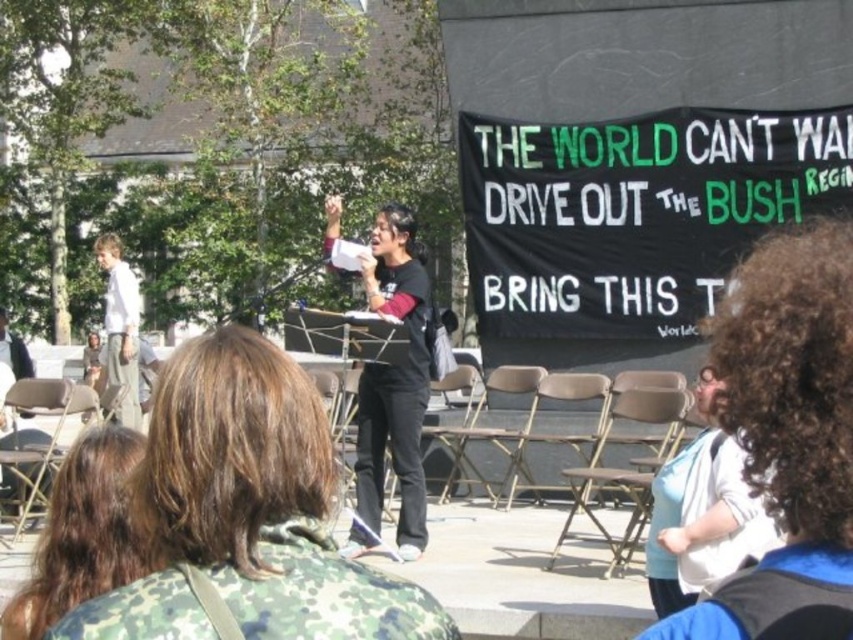
Does dark brown hair at center have a greater width compared to light blue shirt at center?

No, dark brown hair at center is not wider than light blue shirt at center.

Where is `dark brown hair at center`? Image resolution: width=853 pixels, height=640 pixels. dark brown hair at center is located at coordinates (247, 513).

Between camouflage jacket at center and white cotton shirt at left, which one is positioned lower?

Positioned lower is camouflage jacket at center.

Is camouflage jacket at center thinner than white cotton shirt at left?

Yes, camouflage jacket at center is thinner than white cotton shirt at left.

Describe the element at coordinates (82, 532) in the screenshot. I see `camouflage jacket at center` at that location.

You are a GUI agent. You are given a task and a screenshot of the screen. Output one action in this format:
    pyautogui.click(x=<x>, y=<y>)
    Task: Click on the camouflage jacket at center
    This screenshot has height=640, width=853.
    Given the screenshot: What is the action you would take?
    pyautogui.click(x=82, y=532)

Describe the element at coordinates (247, 513) in the screenshot. I see `dark brown hair at center` at that location.

Can you confirm if dark brown hair at center is positioned to the right of camouflage jacket at center?

Indeed, dark brown hair at center is positioned on the right side of camouflage jacket at center.

At what (x,y) coordinates should I click in order to perform the action: click on dark brown hair at center. Please return your answer as a coordinate pair (x, y). Looking at the image, I should click on (247, 513).